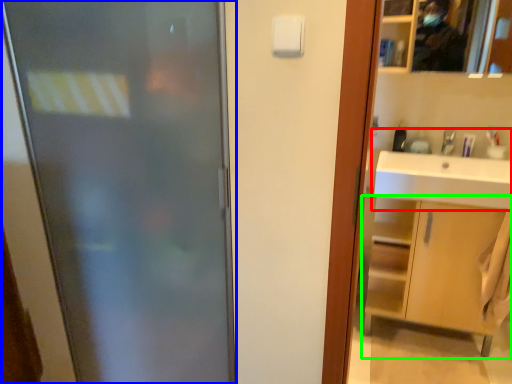
Question: Considering the real-world distances, which object is farthest from sink (highlighted by a red box)? door (highlighted by a blue box) or bathroom cabinet (highlighted by a green box)?

Choices:
 (A) door
 (B) bathroom cabinet

Answer: (A)